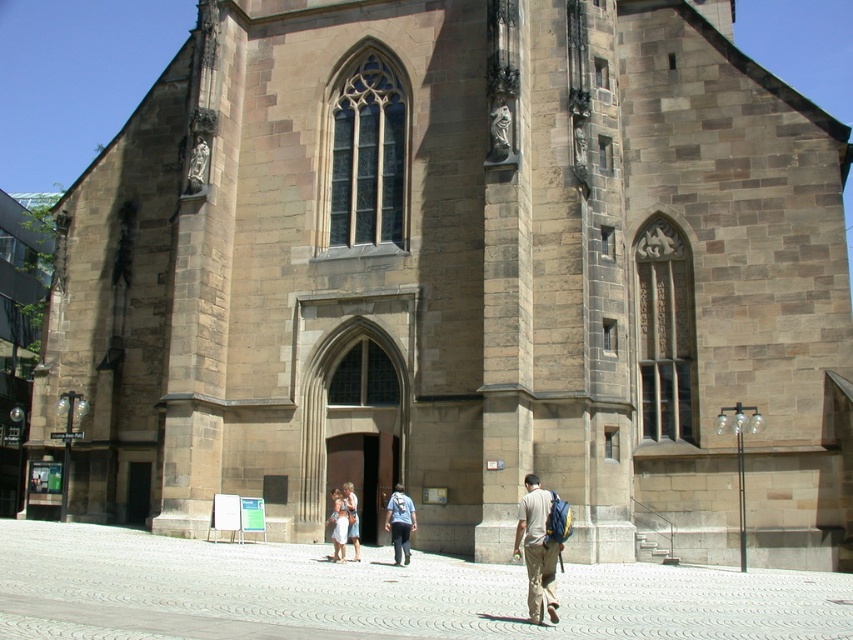
You are standing in front of the historic stone church and notice two points marked on the building facade. The first point is at coordinates point[390,512] and the second at point[338,509]. Based on their positions, which point is closer to you as you face the church?

Point[390,512] is in front of point[338,509], so it is closer to you as you face the church.

You are standing in front of the historic stone church and see both the light brown canvas backpack at lower right and the denim backpack at center. Which backpack is more to the right side?

The light brown canvas backpack at lower right is more to the right side because it is positioned on the right side of the denim backpack at center.

You are standing in front of the historic stone church and notice a light brown canvas backpack at lower right and a light blue denim jeans at center. Which object is wider?

The light brown canvas backpack at lower right is wider than the light blue denim jeans at center.